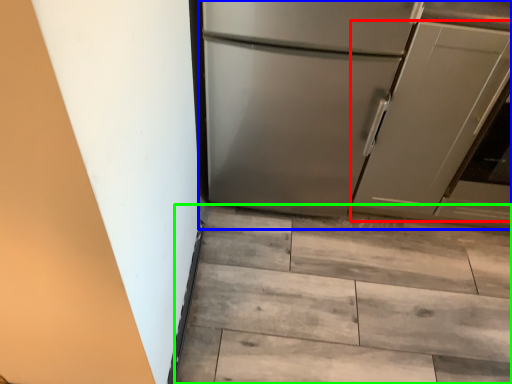
Question: Which object is positioned farthest from door (highlighted by a red box)? Select from refrigerator (highlighted by a blue box) and stairwell (highlighted by a green box).

Choices:
 (A) refrigerator
 (B) stairwell

Answer: (B)